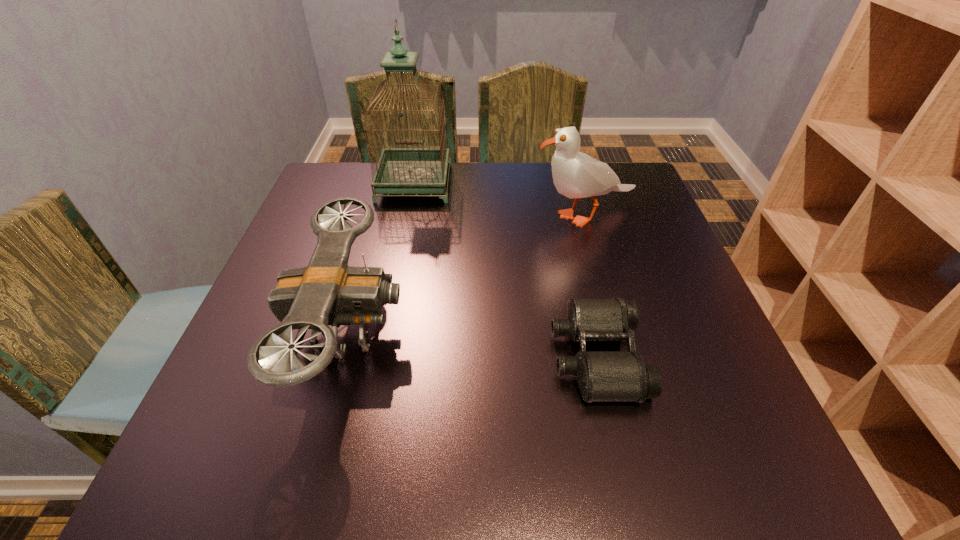
You are a GUI agent. You are given a task and a screenshot of the screen. Output one action in this format:
    pyautogui.click(x=<x>, y=<y>)
    Task: Click on the free space located through the eyepieces of the binoculars
    
    Given the screenshot: What is the action you would take?
    pyautogui.click(x=477, y=356)

The image size is (960, 540). In order to click on free space located through the eyepieces of the binoculars in this screenshot , I will do (x=340, y=356).

Find the location of `birdcage that is at the far edge`. birdcage that is at the far edge is located at coordinates (401, 170).

Identify the location of gull located at the far edge. The width and height of the screenshot is (960, 540). (575, 174).

This screenshot has width=960, height=540. What are the coordinates of `object at the near edge` in the screenshot? It's located at (328, 292).

Find the location of a particular element. The height and width of the screenshot is (540, 960). object that is at the left edge is located at coordinates (328, 292).

The height and width of the screenshot is (540, 960). Find the location of `gull present at the right edge`. gull present at the right edge is located at coordinates tap(575, 174).

Identify the location of binoculars that is at the right edge. (601, 375).

I want to click on object that is at the near left corner, so click(328, 292).

At what (x,y) coordinates should I click in order to perform the action: click on object at the far right corner. Please return your answer as a coordinate pair (x, y). This screenshot has height=540, width=960. Looking at the image, I should click on (575, 174).